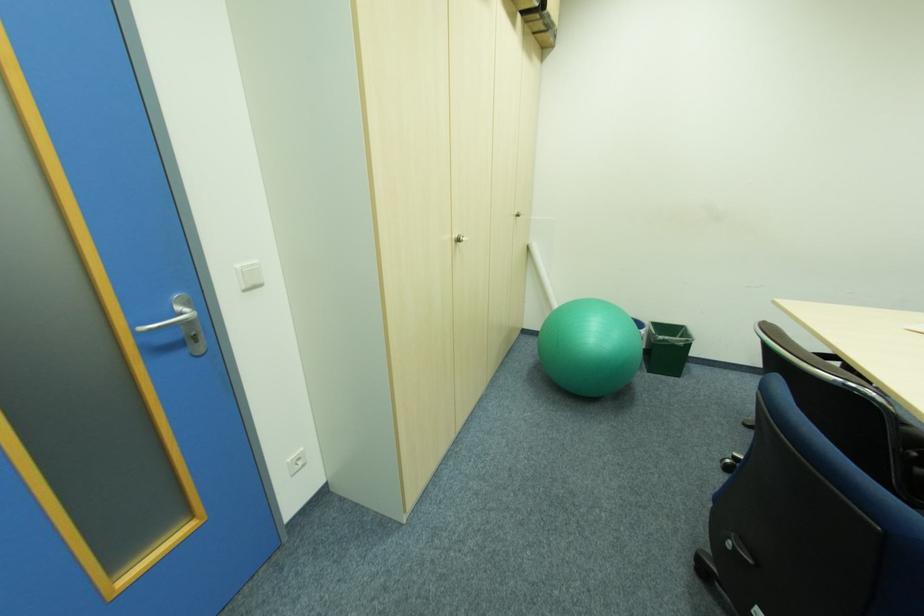
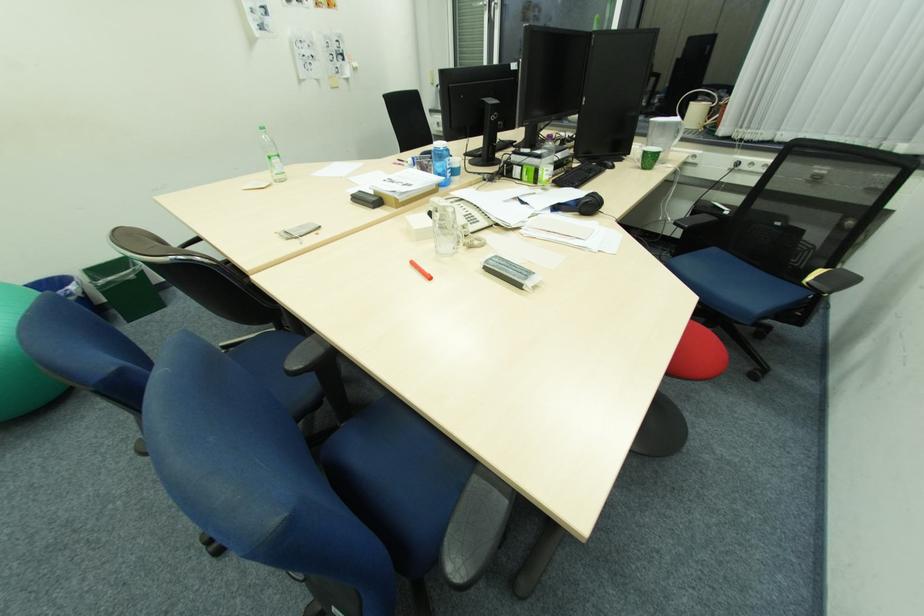
The first image is from the beginning of the video and the second image is from the end. How did the camera likely rotate when shooting the video?

The camera rotated toward right-down.